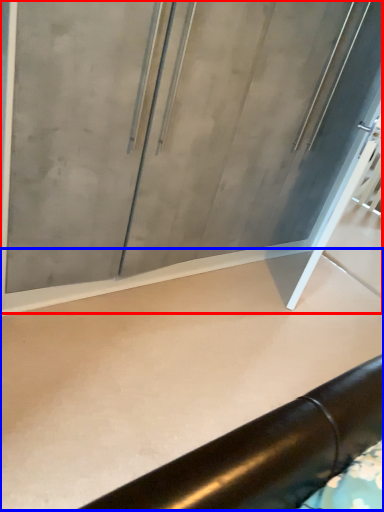
Question: Which object appears farthest to the camera in this image, glass door (highlighted by a red box) or concrete (highlighted by a blue box)?

Choices:
 (A) glass door
 (B) concrete

Answer: (A)